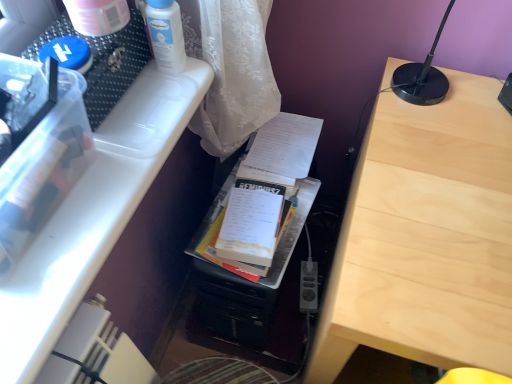
Question: Could you tell me if white plastic container at upper left is turned towards white paper at center?

Choices:
 (A) no
 (B) yes

Answer: (A)

Question: From the image's perspective, is white plastic container at upper left located above white paper at center?

Choices:
 (A) yes
 (B) no

Answer: (B)

Question: From a real-world perspective, is white plastic container at upper left physically above white paper at center?

Choices:
 (A) no
 (B) yes

Answer: (B)

Question: Can you confirm if white plastic container at upper left is positioned to the right of white paper at center?

Choices:
 (A) yes
 (B) no

Answer: (B)

Question: Is white plastic container at upper left to the left of white paper at center from the viewer's perspective?

Choices:
 (A) yes
 (B) no

Answer: (A)

Question: From a real-world perspective, is white plastic container at upper left beneath white paper at center?

Choices:
 (A) no
 (B) yes

Answer: (A)

Question: Does black plastic power plugs and sockets at lower center lie behind white glossy lotion at upper center?

Choices:
 (A) no
 (B) yes

Answer: (B)

Question: Does black plastic power plugs and sockets at lower center have a lesser width compared to white glossy lotion at upper center?

Choices:
 (A) no
 (B) yes

Answer: (A)

Question: Does black plastic power plugs and sockets at lower center appear on the right side of white glossy lotion at upper center?

Choices:
 (A) no
 (B) yes

Answer: (B)

Question: From a real-world perspective, is black plastic power plugs and sockets at lower center physically above white glossy lotion at upper center?

Choices:
 (A) yes
 (B) no

Answer: (B)

Question: Does black plastic power plugs and sockets at lower center contain white glossy lotion at upper center?

Choices:
 (A) no
 (B) yes

Answer: (A)

Question: From the image's perspective, does black plastic power plugs and sockets at lower center appear higher than white glossy lotion at upper center?

Choices:
 (A) no
 (B) yes

Answer: (A)

Question: From a real-world perspective, is light wood table at center positioned under white plastic container at upper left based on gravity?

Choices:
 (A) no
 (B) yes

Answer: (B)